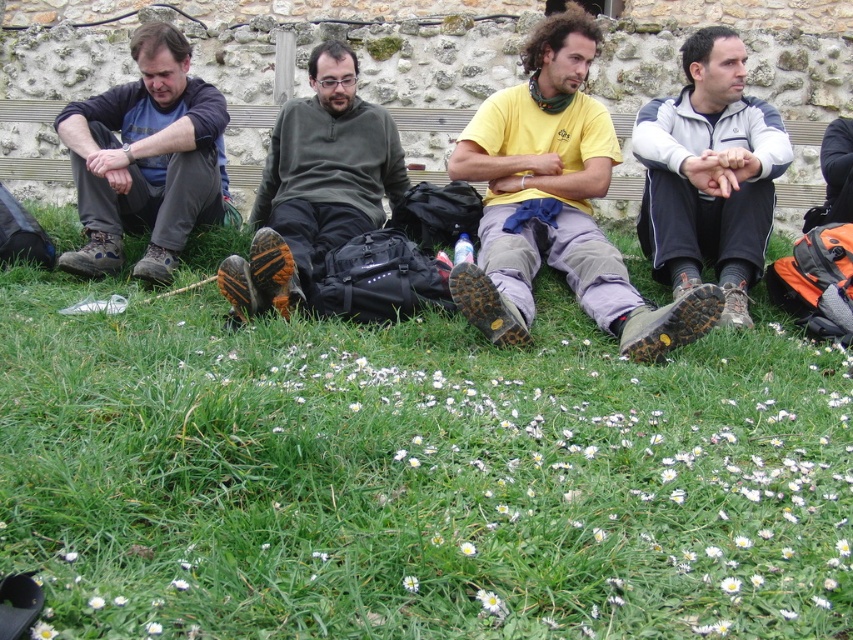
You are standing on the grass and looking at the gray fleece jacket at right and the green grass at lower center. Which object is closer to your feet?

The green grass at lower center is closer to your feet because it is located below the gray fleece jacket at right.

You are standing in the grassy area looking towards the stone wall. Where is the yellow matte shirt at center located in relation to the other people?

The yellow matte shirt at center is located at the center position among the four individuals, positioned at coordinates approximately 0.319 on the x and 0.652 on the y axis.

You are standing in the scene and want to sit down on the green grass at lower center. However, you notice the dark green fabric pants at center are already there. Is the grass below the pants available for you to sit on?

The green grass at lower center is located below the dark green fabric pants at center, so the grass is currently occupied by the pants and not available for sitting.